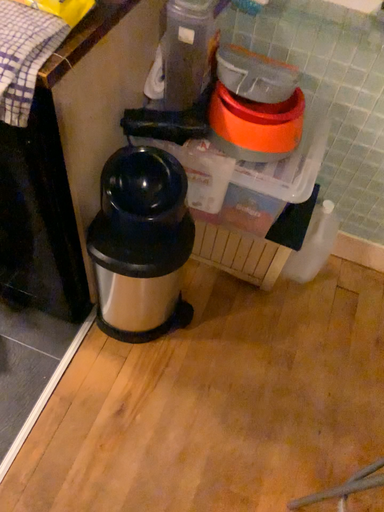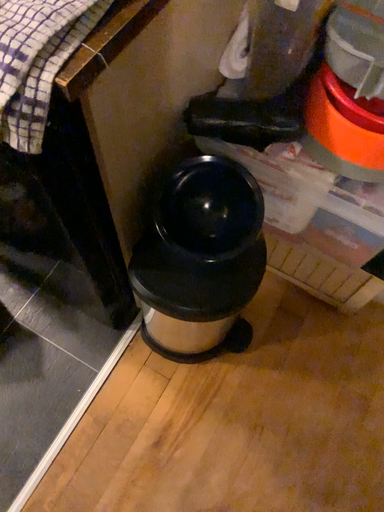
Question: How did the camera likely rotate when shooting the video?

Choices:
 (A) rotated downward
 (B) rotated upward

Answer: (A)